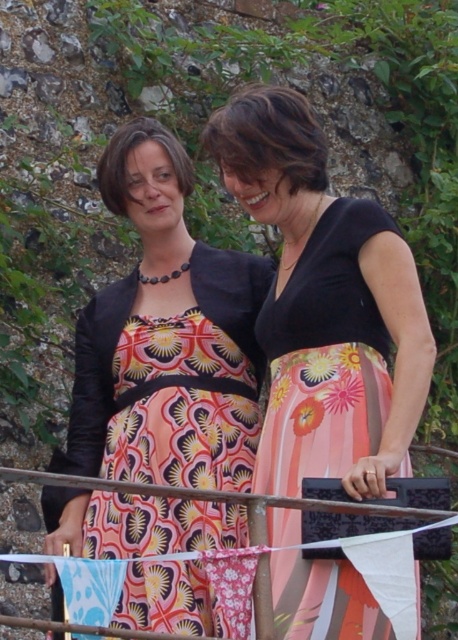
Which is more to the right, matte black dress at center or metallic silver rail at center?

matte black dress at center is more to the right.

The height and width of the screenshot is (640, 458). Identify the location of matte black dress at center. (167, 337).

Does matte black dress at center lie in front of black matte dress at center?

No, matte black dress at center is further to the viewer.

Does matte black dress at center have a larger size compared to black matte dress at center?

No.

Does point (116, 182) come in front of point (288, 440)?

No, it is behind (288, 440).

The height and width of the screenshot is (640, 458). In order to click on matte black dress at center in this screenshot , I will do `click(167, 337)`.

Can you confirm if black matte dress at center is positioned below metallic silver rail at center?

Incorrect, black matte dress at center is not positioned below metallic silver rail at center.

Is point (298, 572) more distant than point (212, 493)?

Yes, it is.

The height and width of the screenshot is (640, 458). Identify the location of black matte dress at center. (325, 305).